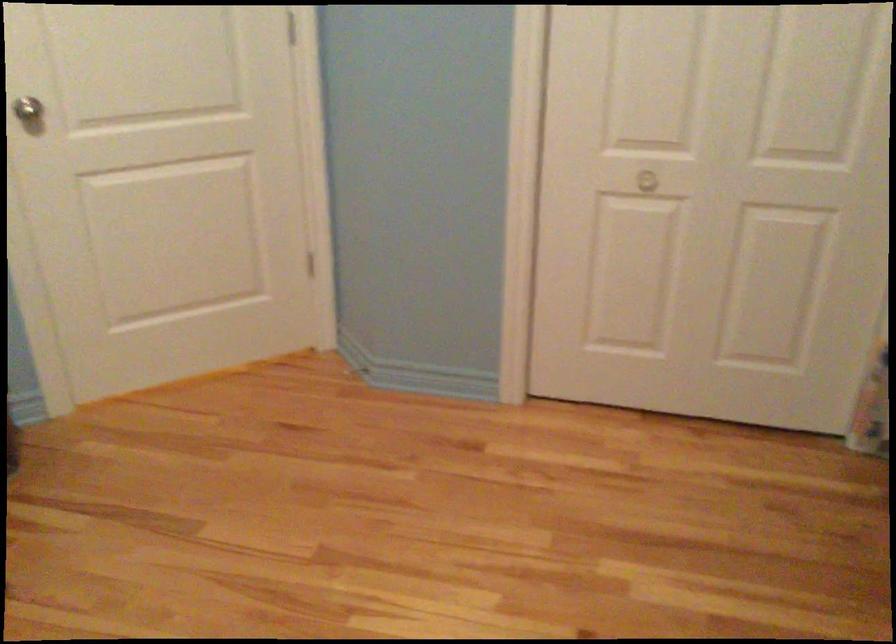
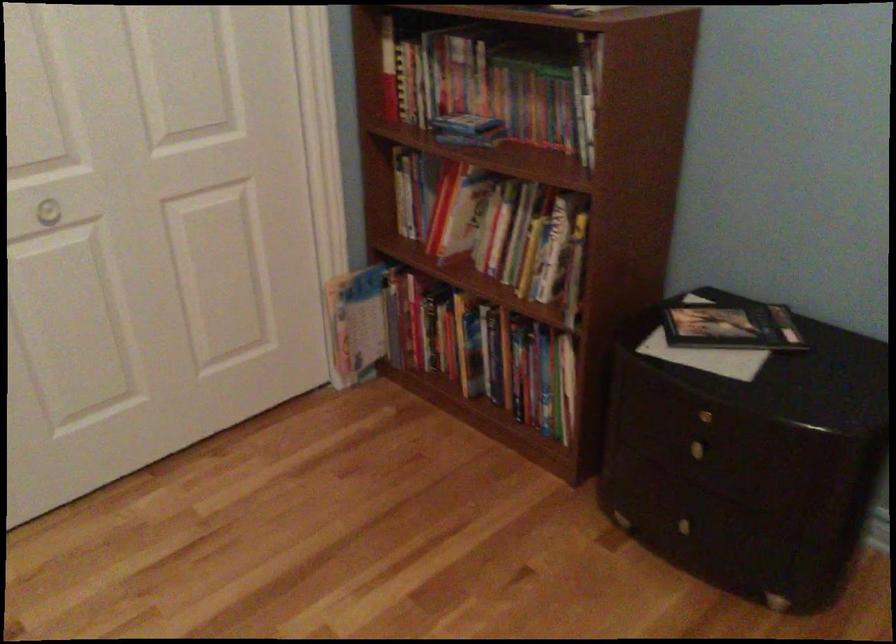
In the second image, find the point that corresponds to (648,176) in the first image.

(47, 212)